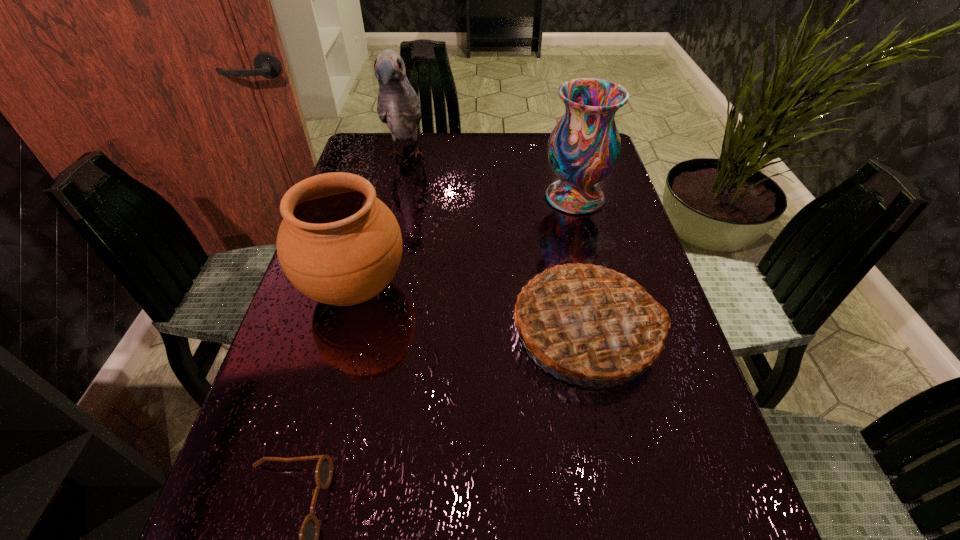
The height and width of the screenshot is (540, 960). What are the coordinates of `pottery located in the left edge section of the desktop` in the screenshot? It's located at (338, 244).

Identify the location of vase that is at the right edge. (583, 149).

Where is `pie located in the right edge section of the desktop`? The width and height of the screenshot is (960, 540). pie located in the right edge section of the desktop is located at coordinates (587, 321).

This screenshot has width=960, height=540. I want to click on object that is at the far left corner, so [398, 106].

Where is `free space at the far edge of the desktop`? The image size is (960, 540). free space at the far edge of the desktop is located at coordinates (517, 147).

In the image, there is a desktop. Where is `vacant space at the left edge`? The image size is (960, 540). vacant space at the left edge is located at coordinates (320, 340).

Where is `free space at the right edge of the desktop`? free space at the right edge of the desktop is located at coordinates (687, 372).

Find the location of `free space at the far left corner`. free space at the far left corner is located at coordinates tap(393, 141).

Where is `empty space that is in between the pottery and the vase`? This screenshot has width=960, height=540. empty space that is in between the pottery and the vase is located at coordinates (465, 243).

Identify the location of free space between the pottery and the pie. The width and height of the screenshot is (960, 540). (471, 309).